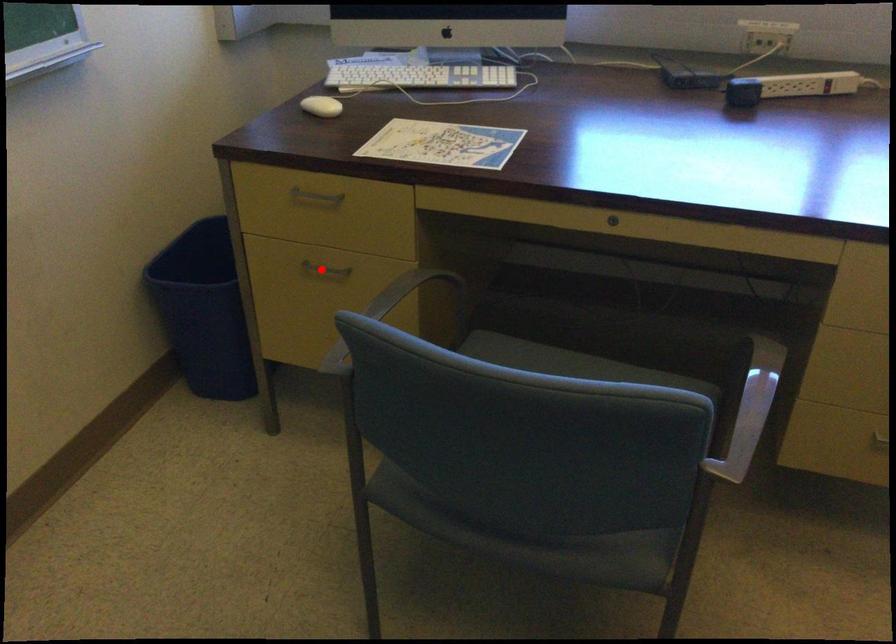
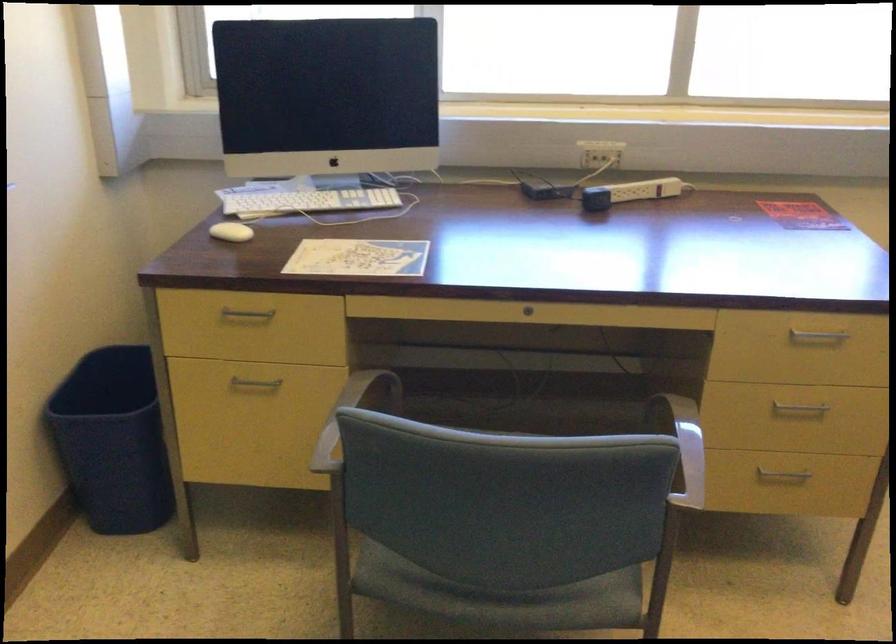
Where in the second image is the point corresponding to the highlighted location from the first image?

(254, 384)